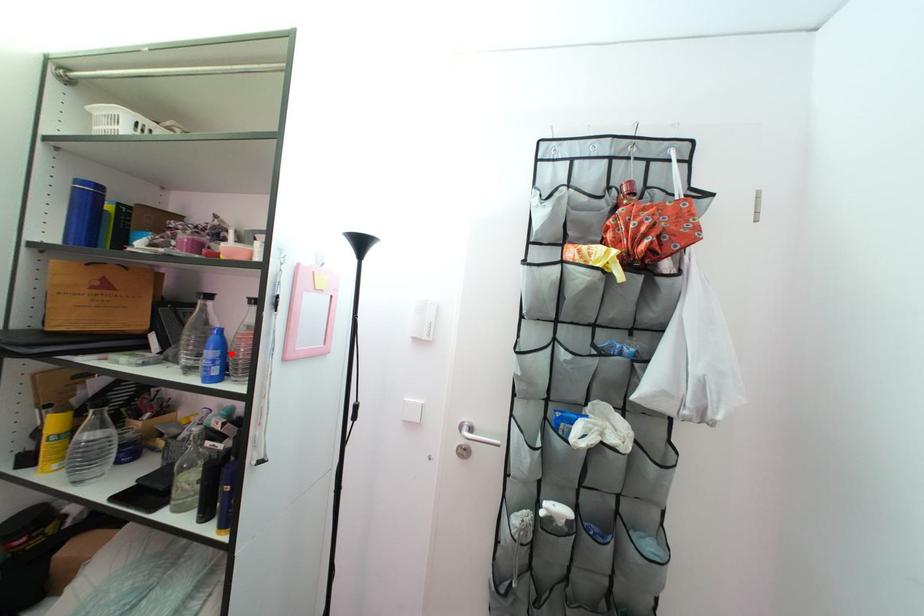
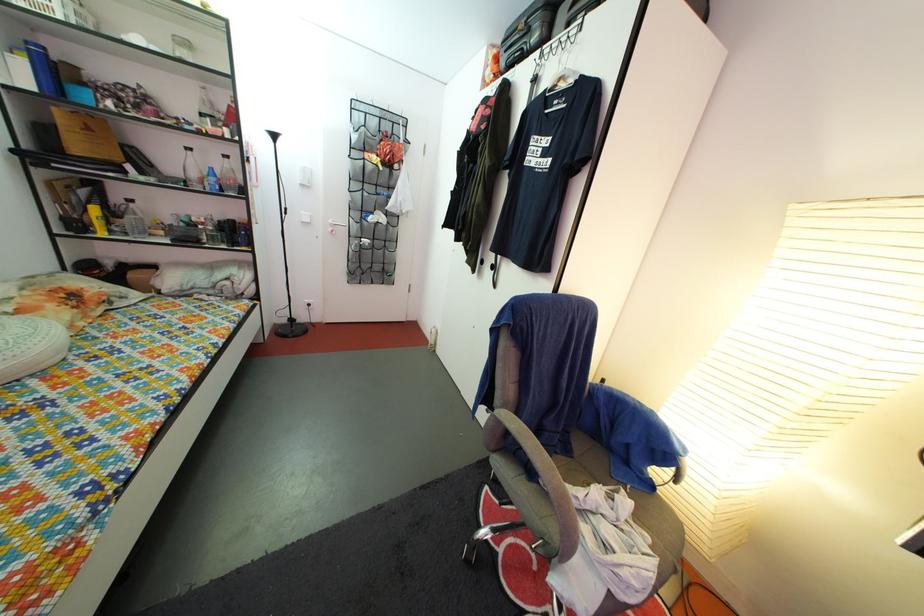
The point at the highlighted location is marked in the first image. Where is the corresponding point in the second image?

(225, 185)